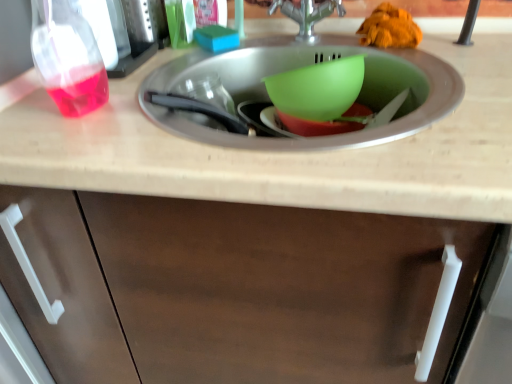
At what (x,y) coordinates should I click in order to perform the action: click on free location in front of blue sponge at upper center, which appears as the second food when viewed from the right. Please return your answer as a coordinate pair (x, y). The width and height of the screenshot is (512, 384). Looking at the image, I should click on (204, 71).